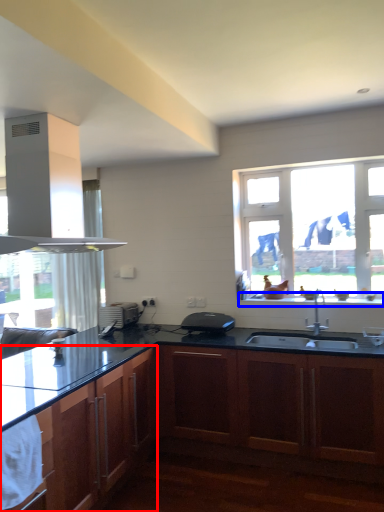
Question: Which object appears farthest to the camera in this image, cabinetry (highlighted by a red box) or window sill (highlighted by a blue box)?

Choices:
 (A) cabinetry
 (B) window sill

Answer: (B)